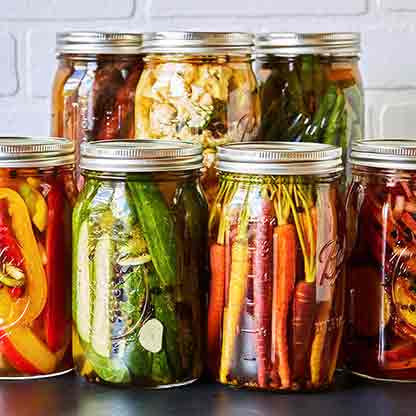
You are a GUI agent. You are given a task and a screenshot of the screen. Output one action in this format:
    pyautogui.click(x=<x>, y=<y>)
    Task: Click on the black countertop
    The width and height of the screenshot is (416, 416).
    Given the screenshot: What is the action you would take?
    pyautogui.click(x=256, y=399)